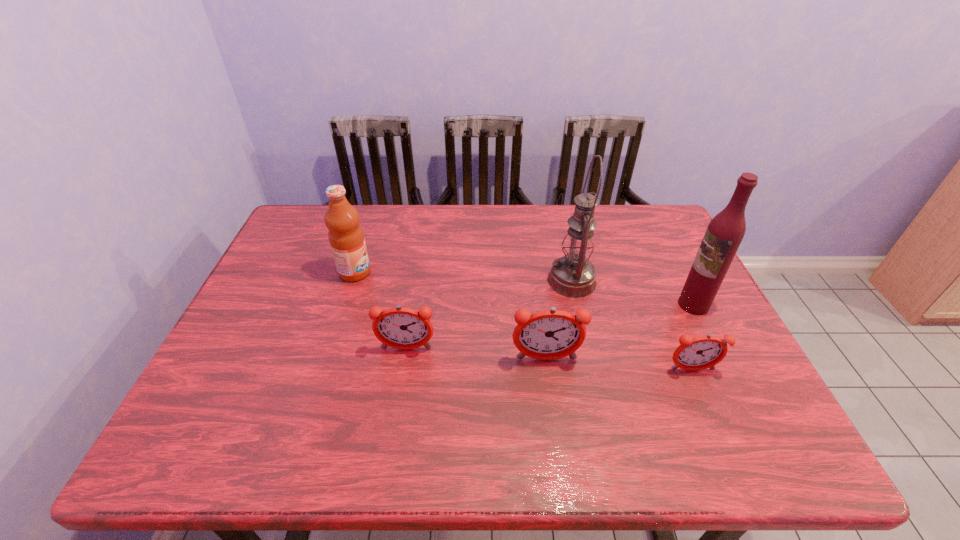
I want to click on free space located 0.070m on the front-facing side of the second alarm clock from left to right, so click(x=550, y=392).

This screenshot has height=540, width=960. What are the coordinates of `free space located on the front-facing side of the rightmost alarm clock` in the screenshot? It's located at click(702, 394).

I want to click on free spot located 0.240m on the back of the oil lamp, so click(x=558, y=220).

At what (x,y) coordinates should I click in order to perform the action: click on blank area located 0.280m on the label of the liquor. Please return your answer as a coordinate pair (x, y). Looking at the image, I should click on (576, 305).

This screenshot has height=540, width=960. What are the coordinates of `vacant space situated 0.120m on the label of the liquor` in the screenshot? It's located at (635, 305).

Where is `vacant area situated 0.270m on the label of the liquor`? This screenshot has height=540, width=960. vacant area situated 0.270m on the label of the liquor is located at coordinates (579, 305).

This screenshot has height=540, width=960. I want to click on vacant space located on the front label of the fourth shortest object, so click(x=473, y=272).

Locate an element on the screen. alarm clock located in the right edge section of the desktop is located at coordinates (702, 352).

Locate an element on the screen. This screenshot has width=960, height=540. liquor situated at the right edge is located at coordinates (724, 234).

This screenshot has height=540, width=960. Identify the location of vacant space at the far edge of the desktop. (371, 221).